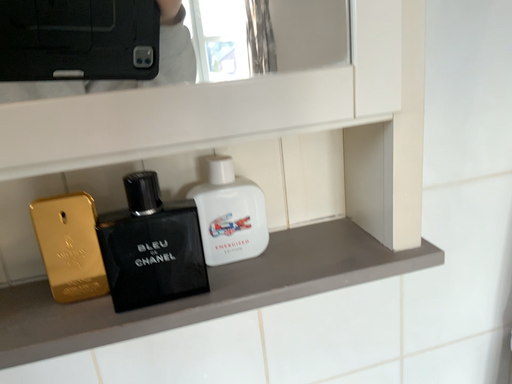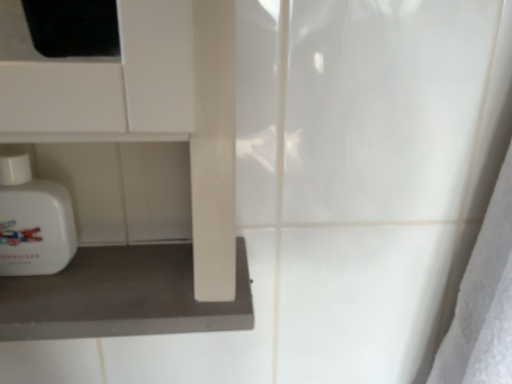
Question: Which way did the camera rotate in the video?

Choices:
 (A) rotated right
 (B) rotated left

Answer: (B)